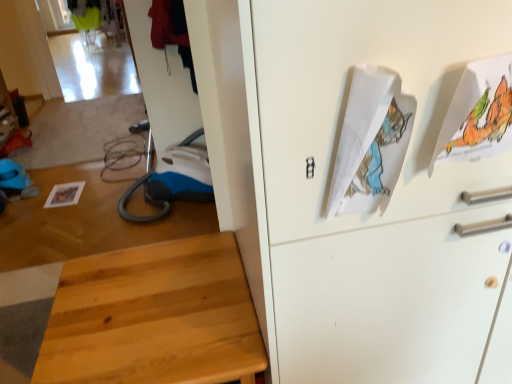
Question: Could you tell me if white paper at upper right, the 1th wrapping paper viewed from the left, is turned towards white paper with colorful illustration at upper right, the 1th wrapping paper viewed from the right?

Choices:
 (A) yes
 (B) no

Answer: (B)

Question: From the image's perspective, is white paper at upper right, which is counted as the second wrapping paper, starting from the right, over white paper with colorful illustration at upper right, which is the second wrapping paper from left to right?

Choices:
 (A) no
 (B) yes

Answer: (A)

Question: Is white paper at upper right, the 1th wrapping paper viewed from the left, positioned beyond the bounds of white paper with colorful illustration at upper right, the 1th wrapping paper viewed from the right?

Choices:
 (A) yes
 (B) no

Answer: (A)

Question: Is white paper at upper right, which is counted as the second wrapping paper, starting from the right, to the right of white paper with colorful illustration at upper right, which is the second wrapping paper from left to right, from the viewer's perspective?

Choices:
 (A) no
 (B) yes

Answer: (A)

Question: Is white paper at upper right, the 1th wrapping paper viewed from the left, wider than white paper with colorful illustration at upper right, the 1th wrapping paper viewed from the right?

Choices:
 (A) no
 (B) yes

Answer: (A)

Question: From the image's perspective, relative to white paper at upper right, the 1th wrapping paper viewed from the left, is white paper with colorful illustration at upper right, the 1th wrapping paper viewed from the right, above or below?

Choices:
 (A) above
 (B) below

Answer: (A)

Question: In the image, is white paper with colorful illustration at upper right, the 1th wrapping paper viewed from the right, positioned in front of or behind white paper at upper right, the 1th wrapping paper viewed from the left?

Choices:
 (A) front
 (B) behind

Answer: (B)

Question: Is point (499, 71) closer or farther from the camera than point (385, 142)?

Choices:
 (A) closer
 (B) farther

Answer: (A)

Question: Based on their sizes in the image, would you say white paper with colorful illustration at upper right, which is the second wrapping paper from left to right, is bigger or smaller than white paper at upper right, which is counted as the second wrapping paper, starting from the right?

Choices:
 (A) small
 (B) big

Answer: (A)

Question: Looking at their shapes, would you say light wood stool at lower left is wider or thinner than white paper with colorful illustration at upper right, which is the second wrapping paper from left to right?

Choices:
 (A) thin
 (B) wide

Answer: (B)

Question: Considering their positions, is light wood stool at lower left located in front of or behind white paper with colorful illustration at upper right, the 1th wrapping paper viewed from the right?

Choices:
 (A) front
 (B) behind

Answer: (B)

Question: From the image's perspective, is light wood stool at lower left located above or below white paper with colorful illustration at upper right, the 1th wrapping paper viewed from the right?

Choices:
 (A) above
 (B) below

Answer: (B)

Question: Does point (55, 324) appear closer or farther from the camera than point (509, 97)?

Choices:
 (A) closer
 (B) farther

Answer: (B)

Question: From the image's perspective, is white paper with colorful illustration at upper right, the 1th wrapping paper viewed from the right, positioned above or below light wood stool at lower left?

Choices:
 (A) below
 (B) above

Answer: (B)

Question: Is white paper with colorful illustration at upper right, the 1th wrapping paper viewed from the right, inside or outside of light wood stool at lower left?

Choices:
 (A) outside
 (B) inside

Answer: (A)